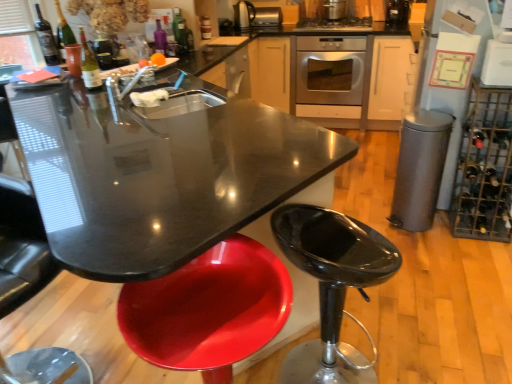
I want to click on spots to the right of glossy plastic bar stool at lower right, so (x=417, y=348).